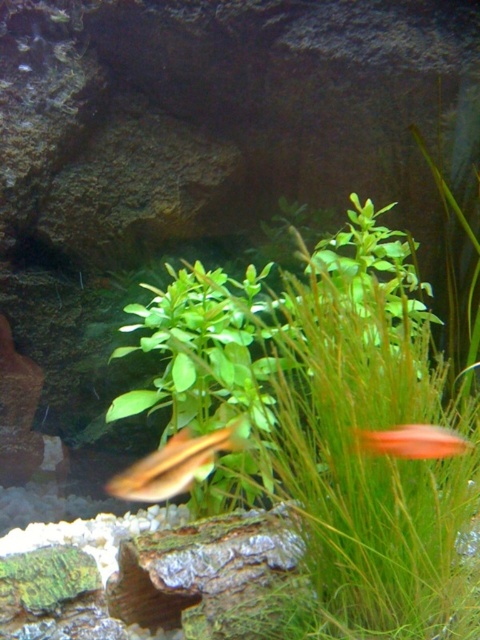
You are an aquarist observing the aquarium. You notice the translucent yellowish fish at center and the orange glossy fish at right. Which fish is closer to the front of the aquarium?

The translucent yellowish fish at center is closer to the front of the aquarium because the orange glossy fish at right is behind it.

You are an aquatic plant that is 20 inches tall. You want to move closer to the orange glossy fish at right from the translucent yellowish fish at center. Is there enough space between them for you to fit in?

The distance between the translucent yellowish fish at center and the orange glossy fish at right is 28.51 inches. Since the plant is 20 inches tall, it can fit in the space between them.

Looking at this image, you are an aquatic enthusiast observing the aquarium. You notice the translucent yellowish fish at center and the orange glossy fish at right. Which fish is positioned closer to the left side of the aquarium?

The translucent yellowish fish at center is positioned to the left of the orange glossy fish at right, so it is closer to the left side of the aquarium.